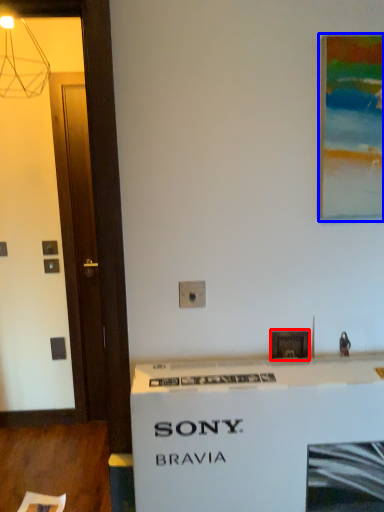
Question: Among these objects, which one is nearest to the camera, picture frame (highlighted by a red box) or picture frame (highlighted by a blue box)?

Choices:
 (A) picture frame
 (B) picture frame

Answer: (B)